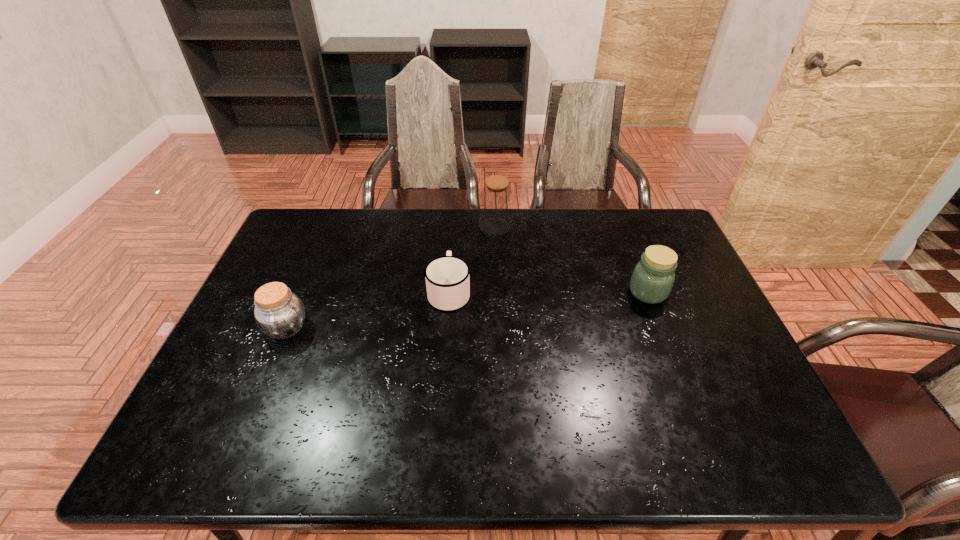
The height and width of the screenshot is (540, 960). What are the coordinates of `free space that is in between the mug and the second jar from left to right` in the screenshot? It's located at (472, 259).

Locate an element on the screen. This screenshot has width=960, height=540. free spot between the leftmost object and the rightmost object is located at coordinates (468, 310).

Identify the location of free space between the rightmost object and the second object from left to right. This screenshot has width=960, height=540. (548, 292).

Locate an element on the screen. empty location between the rightmost jar and the tallest object is located at coordinates 572,259.

Image resolution: width=960 pixels, height=540 pixels. I want to click on object that stands as the second closest to the mug, so click(x=279, y=313).

Identify the location of the closest object to the leftmost jar. Image resolution: width=960 pixels, height=540 pixels. (447, 277).

Select which jar appears as the closest to the leftmost object. Please provide its 2D coordinates. Your answer should be formatted as a tuple, i.e. [(x, y)], where the tuple contains the x and y coordinates of a point satisfying the conditions above.

[(496, 199)]

Identify the location of jar that stands as the closest to the mug. Image resolution: width=960 pixels, height=540 pixels. (496, 199).

At what (x,y) coordinates should I click in order to perform the action: click on vacant area that satisfies the following two spatial constraints: 1. on the side of the second object from right to left with the handle; 2. on the left side of the shortest object. Please return your answer as a coordinate pair (x, y). The height and width of the screenshot is (540, 960). Looking at the image, I should click on (454, 226).

Locate an element on the screen. Image resolution: width=960 pixels, height=540 pixels. vacant position in the image that satisfies the following two spatial constraints: 1. on the back side of the second object from right to left; 2. on the right side of the leftmost jar is located at coordinates pyautogui.click(x=328, y=226).